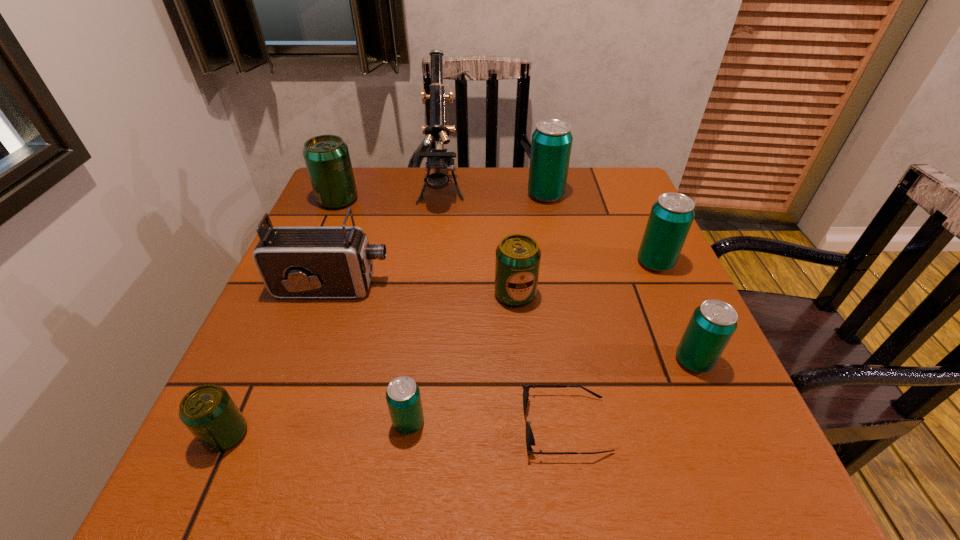
This screenshot has height=540, width=960. Find the location of `the second nearest teal beer can`. the second nearest teal beer can is located at coordinates (713, 323).

The image size is (960, 540). Find the location of `the leftmost teal beer can`. the leftmost teal beer can is located at coordinates (403, 398).

Locate an element on the screen. Image resolution: width=960 pixels, height=540 pixels. the nearest teal beer can is located at coordinates (403, 398).

Find the location of `the nearest green beer can`. the nearest green beer can is located at coordinates (208, 411).

Find the location of a particular element. The width and height of the screenshot is (960, 540). sunglasses is located at coordinates (530, 441).

Find the location of `free space located through the eyepiece of the tallest object`. free space located through the eyepiece of the tallest object is located at coordinates (429, 292).

This screenshot has height=540, width=960. Find the location of `vacant region located 0.250m on the front of the second teal beer can from left to right`. vacant region located 0.250m on the front of the second teal beer can from left to right is located at coordinates (561, 268).

In order to click on free space located 0.060m at the lens of the camcorder in this screenshot , I will do `click(417, 287)`.

Find the location of a particular element. The width and height of the screenshot is (960, 540). vacant space positioned 0.170m on the front of the farthest green beer can is located at coordinates (315, 253).

Where is `vacant point located on the back of the second farthest teal beer can`? This screenshot has width=960, height=540. vacant point located on the back of the second farthest teal beer can is located at coordinates (635, 216).